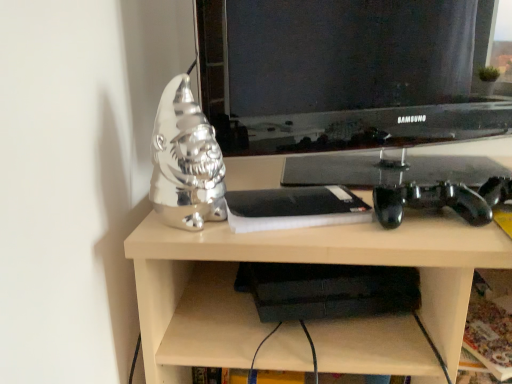
Question: Is shiny silver gnome at left facing towards metallic silver gnome at left?

Choices:
 (A) no
 (B) yes

Answer: (A)

Question: Is metallic silver gnome at left inside shiny silver gnome at left?

Choices:
 (A) no
 (B) yes

Answer: (A)

Question: Would you consider shiny silver gnome at left to be distant from metallic silver gnome at left?

Choices:
 (A) yes
 (B) no

Answer: (B)

Question: Is shiny silver gnome at left looking in the opposite direction of metallic silver gnome at left?

Choices:
 (A) no
 (B) yes

Answer: (A)

Question: Considering the relative sizes of shiny silver gnome at left and metallic silver gnome at left in the image provided, is shiny silver gnome at left wider than metallic silver gnome at left?

Choices:
 (A) no
 (B) yes

Answer: (A)

Question: In terms of height, does metallic silver gnome at left look taller or shorter compared to shiny silver gnome at left?

Choices:
 (A) tall
 (B) short

Answer: (A)

Question: Considering the relative positions of metallic silver gnome at left and shiny silver gnome at left in the image provided, is metallic silver gnome at left to the left or to the right of shiny silver gnome at left?

Choices:
 (A) right
 (B) left

Answer: (A)

Question: From the image's perspective, is metallic silver gnome at left located above or below shiny silver gnome at left?

Choices:
 (A) above
 (B) below

Answer: (B)

Question: Considering their positions, is metallic silver gnome at left located in front of or behind shiny silver gnome at left?

Choices:
 (A) behind
 (B) front

Answer: (B)

Question: Do you think matte black television at center is within shiny silver gnome at left, or outside of it?

Choices:
 (A) outside
 (B) inside

Answer: (A)

Question: From a real-world perspective, is matte black television at center positioned above or below shiny silver gnome at left?

Choices:
 (A) above
 (B) below

Answer: (A)

Question: From their relative heights in the image, would you say matte black television at center is taller or shorter than shiny silver gnome at left?

Choices:
 (A) tall
 (B) short

Answer: (A)

Question: Considering the relative positions of matte black television at center and shiny silver gnome at left in the image provided, is matte black television at center to the left or to the right of shiny silver gnome at left?

Choices:
 (A) right
 (B) left

Answer: (A)

Question: In terms of height, does shiny silver gnome at left look taller or shorter compared to metallic silver gnome at left?

Choices:
 (A) tall
 (B) short

Answer: (B)

Question: Choose the correct answer: Is shiny silver gnome at left inside metallic silver gnome at left or outside it?

Choices:
 (A) inside
 (B) outside

Answer: (B)